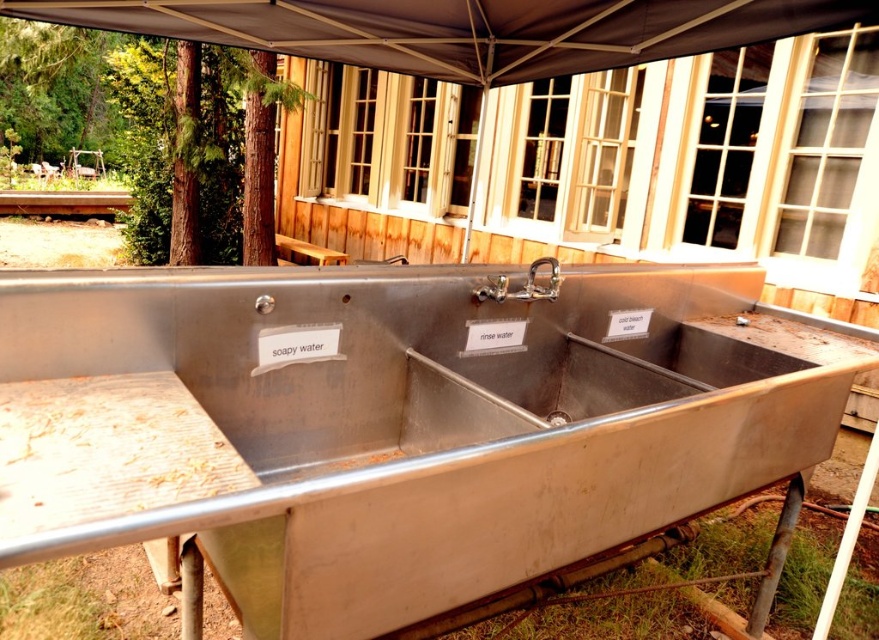
Does silver metallic faucet at upper center have a lesser width compared to brown wooden picnic table at center?

Yes.

From the picture: Who is positioned more to the left, silver metallic faucet at upper center or brown wooden picnic table at center?

Positioned to the left is brown wooden picnic table at center.

Is point (527, 300) positioned in front of point (338, 253)?

Yes, point (527, 300) is closer to viewer.

At what (x,y) coordinates should I click in order to perform the action: click on silver metallic faucet at upper center. Please return your answer as a coordinate pair (x, y). The image size is (879, 640). Looking at the image, I should click on pyautogui.click(x=540, y=284).

Between point (44, 3) and point (282, 243), which one is positioned in front?

Point (44, 3) is more forward.

Does brown fabric canopy at upper center have a greater height compared to brown wooden picnic table at center?

Incorrect, brown fabric canopy at upper center's height is not larger of brown wooden picnic table at center's.

Is point (137, 20) less distant than point (340, 260)?

That is True.

Identify the location of brown fabric canopy at upper center. (462, 29).

Is brown fabric canopy at upper center taller than silver metallic faucet at upper center?

Correct, brown fabric canopy at upper center is much taller as silver metallic faucet at upper center.

Between point (531, 4) and point (547, 292), which one is positioned in front?

Point (547, 292) is in front.

Find the location of a particular element. brown fabric canopy at upper center is located at coordinates (462, 29).